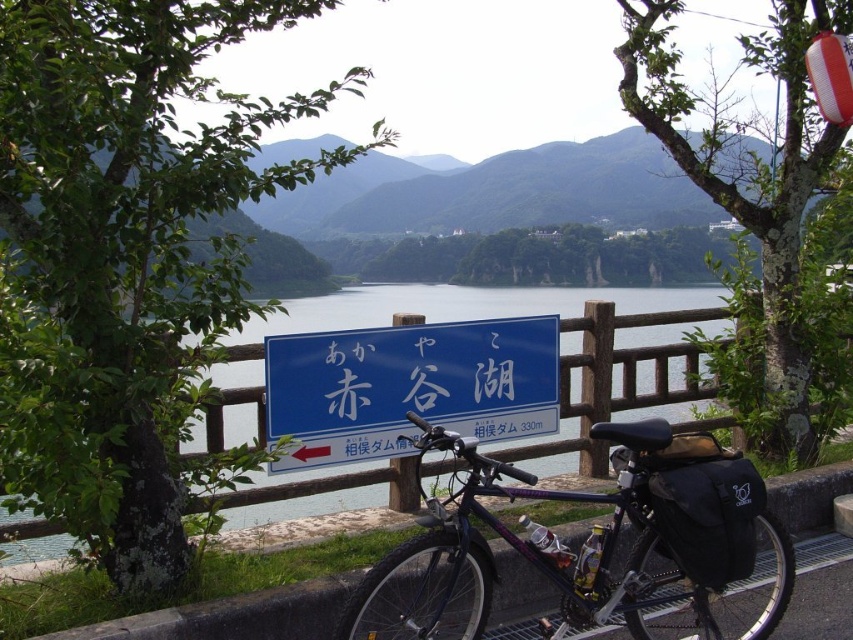
You are standing at the signboard pointing towards Soyama Dam. There is a point marked at coordinates (587, 538). What object is located at that point?

The point at coordinates (587, 538) marks the location of the metallic purple bicycle at center.

You are a hiker who just arrived at the lakeside and wants to check the Soyama Dam signboard. You notice both the metallic purple bicycle at center and the blue plastic sign at center. Which one is taller?

The metallic purple bicycle at center is much taller than the blue plastic sign at center.